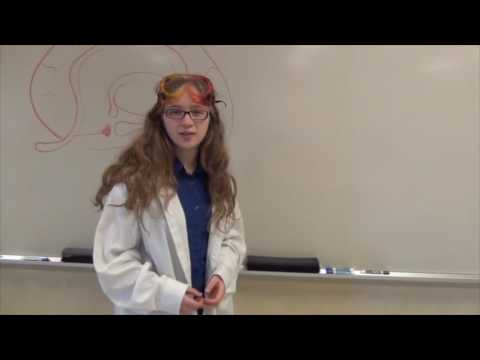
Where is `markers`? Image resolution: width=480 pixels, height=360 pixels. markers is located at coordinates [x=378, y=270], [x=346, y=272], [x=338, y=269].